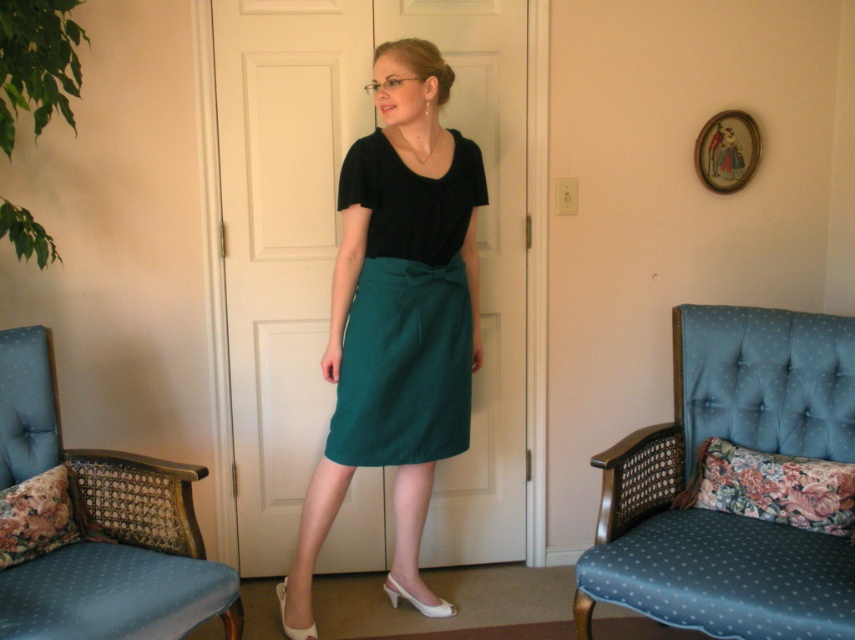
Question: Does blue fabric armchair at right come in front of blue fabric armchair at left?

Choices:
 (A) no
 (B) yes

Answer: (A)

Question: Does emerald green fabric skirt at center have a lesser width compared to teal fabric skirt at center?

Choices:
 (A) no
 (B) yes

Answer: (A)

Question: Which of the following is the closest to the observer?

Choices:
 (A) (770, 358)
 (B) (404, 365)
 (C) (136, 540)

Answer: (C)

Question: Which is nearer to the blue fabric armchair at left?

Choices:
 (A) emerald green fabric skirt at center
 (B) teal fabric skirt at center
 (C) blue fabric armchair at right

Answer: (A)

Question: Does emerald green fabric skirt at center have a lesser width compared to blue fabric armchair at right?

Choices:
 (A) no
 (B) yes

Answer: (B)

Question: Which of the following is the closest to the observer?

Choices:
 (A) (830, 618)
 (B) (217, 563)
 (C) (410, 198)

Answer: (A)